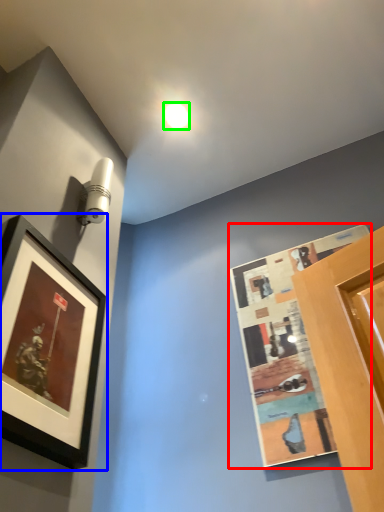
Question: Which is nearer to the picture frame (highlighted by a red box)? picture frame (highlighted by a blue box) or droplight (highlighted by a green box).

Choices:
 (A) picture frame
 (B) droplight

Answer: (A)